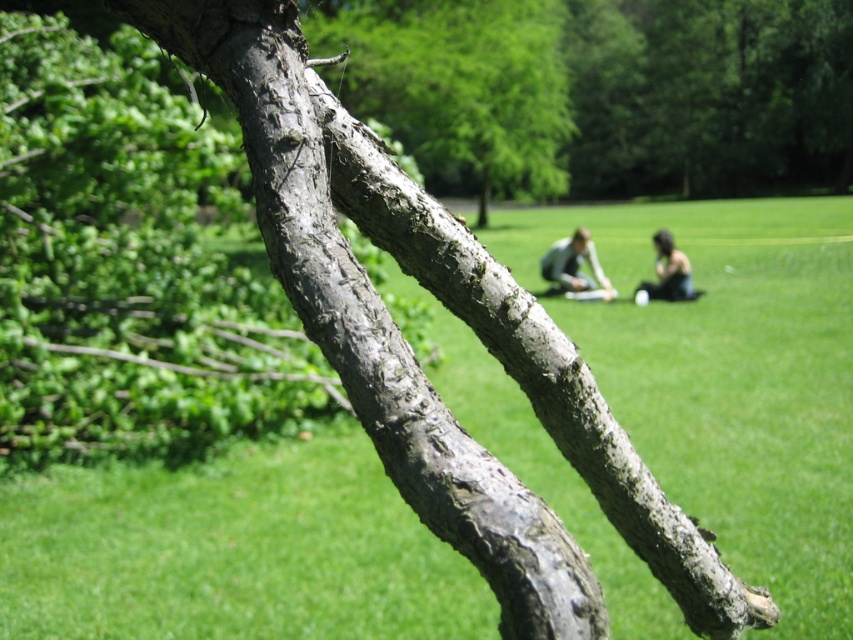
Question: Estimate the real-world distances between objects in this image. Which object is farther from the dark hair person at lower right?

Choices:
 (A) gray rough bark tree trunk at center
 (B) matte gray sweater at center
 (C) gray rough bark branch at upper center
 (D) green rough bark tree at upper center

Answer: (A)

Question: Which of the following is the closest to the observer?

Choices:
 (A) gray rough bark tree trunk at center
 (B) gray rough bark branch at upper center
 (C) matte gray sweater at center

Answer: (A)

Question: Does green grassy at center appear under dark hair person at lower right?

Choices:
 (A) yes
 (B) no

Answer: (A)

Question: Estimate the real-world distances between objects in this image. Which object is farther from the green grassy at center?

Choices:
 (A) green rough bark tree at upper center
 (B) gray rough bark branch at upper center
 (C) gray rough bark tree trunk at center

Answer: (C)

Question: Does green rough bark tree at upper center have a larger size compared to light brown fabric at lower center?

Choices:
 (A) yes
 (B) no

Answer: (A)

Question: Does green rough bark tree at upper center appear on the left side of matte gray sweater at center?

Choices:
 (A) yes
 (B) no

Answer: (B)